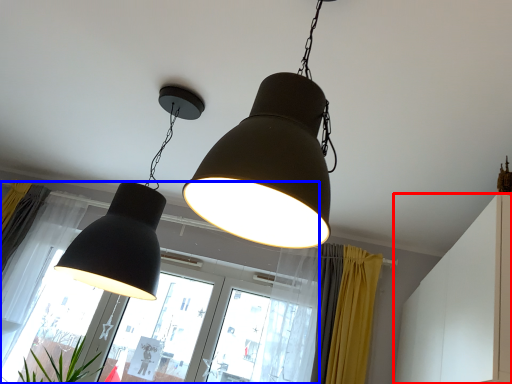
Question: Which of the following is the closest to the observer, dresser (highlighted by a red box) or bay window (highlighted by a blue box)?

Choices:
 (A) dresser
 (B) bay window

Answer: (A)